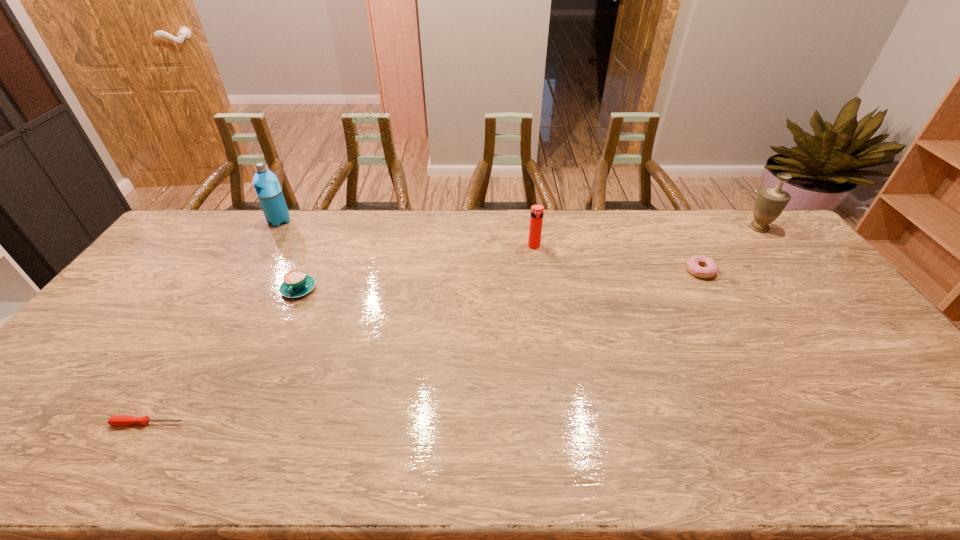
This screenshot has width=960, height=540. I want to click on screwdriver, so click(116, 420).

Where is `free space located 0.190m on the left of the left thermos bottle`? free space located 0.190m on the left of the left thermos bottle is located at coordinates (217, 221).

At what (x,y) coordinates should I click in order to perform the action: click on vacant space located 0.320m on the left of the rightmost object. Please return your answer as a coordinate pair (x, y). Looking at the image, I should click on (659, 227).

Find the location of `vacant space located on the back of the shorter thermos bottle`. vacant space located on the back of the shorter thermos bottle is located at coordinates (531, 222).

You are a GUI agent. You are given a task and a screenshot of the screen. Output one action in this format:
    pyautogui.click(x=<x>, y=<y>)
    Task: Click on the free spot located with the handle on the right side of the fourth object from right to left
    The image size is (960, 540).
    Given the screenshot: What is the action you would take?
    pyautogui.click(x=276, y=339)

Image resolution: width=960 pixels, height=540 pixels. What are the coordinates of `blank space located 0.230m on the right of the doughnut` in the screenshot? It's located at (785, 271).

Locate an element on the screen. The width and height of the screenshot is (960, 540). free space located 0.290m at the tip of the screwdriver is located at coordinates (307, 423).

I want to click on urn present at the far edge, so click(771, 201).

The height and width of the screenshot is (540, 960). In order to click on object located in the right edge section of the desktop in this screenshot , I will do (771, 201).

At what (x,y) coordinates should I click in order to perform the action: click on object that is at the far right corner. Please return your answer as a coordinate pair (x, y). Looking at the image, I should click on (771, 201).